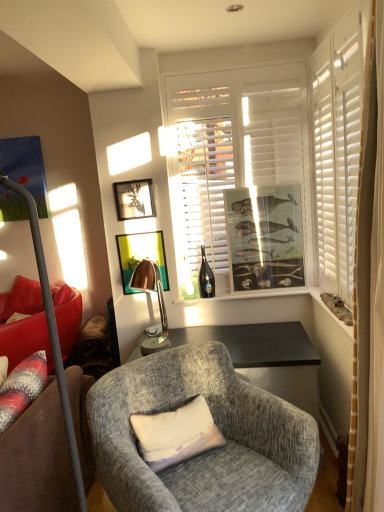
The image size is (384, 512). In order to click on vacant space underneath matte wooden picture frame at center, the first picture frame in the right-to-left sequence (from a real-world perspective) in this screenshot , I will do `click(279, 291)`.